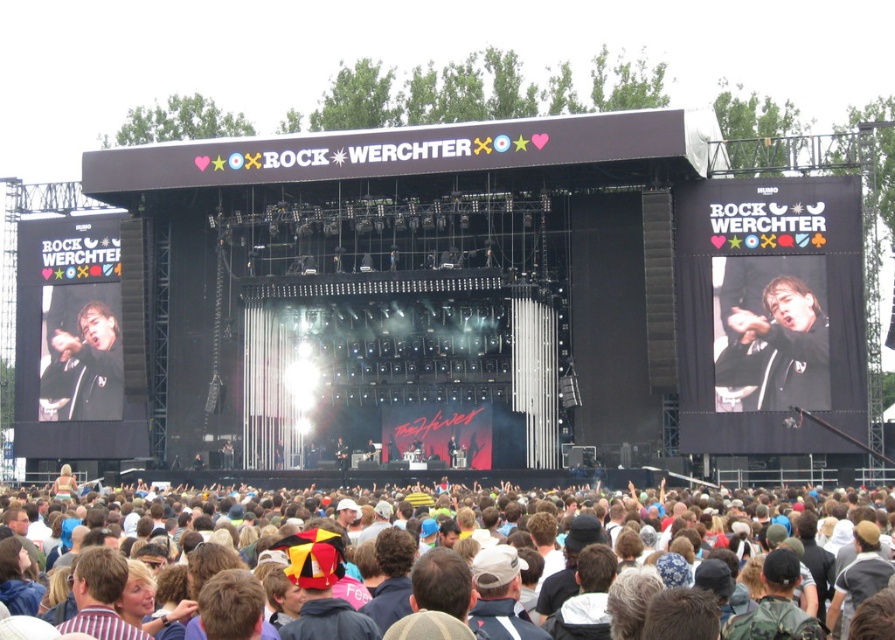
Is dark brown hair at lower center positioned behind matte black jacket at center?

That is False.

Can you confirm if dark brown hair at lower center is bigger than matte black jacket at center?

Yes.

Who is more forward, (369,595) or (90,368)?

Point (369,595)

Image resolution: width=895 pixels, height=640 pixels. Identify the location of dark brown hair at lower center. (522, 586).

Which is more to the right, dark brown hair at lower center or black matte jacket at upper right?

From the viewer's perspective, black matte jacket at upper right appears more on the right side.

Which is behind, point (412, 593) or point (763, 289)?

Positioned behind is point (763, 289).

Locate an element on the screen. dark brown hair at lower center is located at coordinates (522, 586).

Who is positioned more to the right, black matte jacket at upper right or matte black jacket at center?

From the viewer's perspective, black matte jacket at upper right appears more on the right side.

Who is more forward, (770, 321) or (69, 360)?

Point (770, 321)

In order to click on black matte jacket at upper right in this screenshot , I will do `click(774, 348)`.